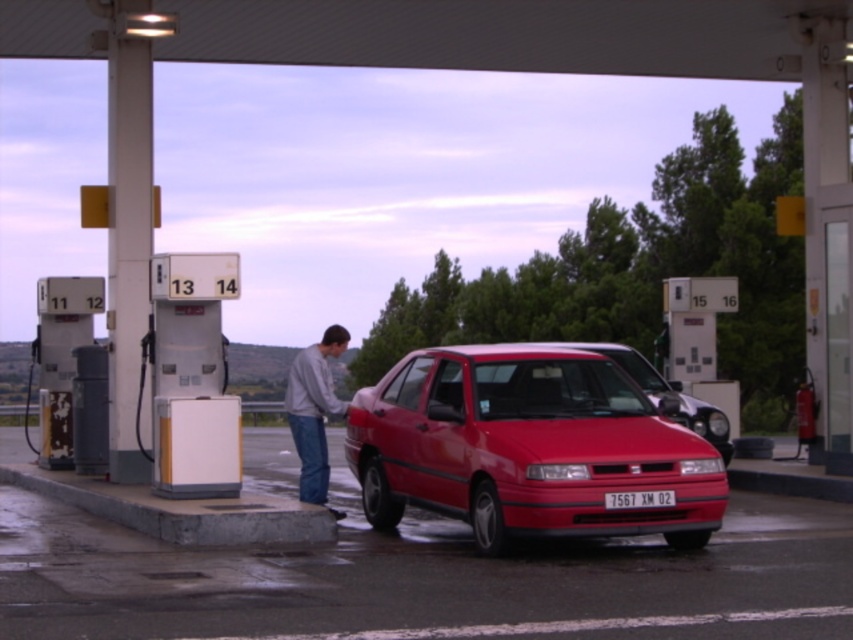
You are a delivery driver who needs to park your truck next to the matte red sedan at center. The truck is 1.5 meters wider than the sedan. Can you safely park your truck without overlapping the white plastic license plate at center?

The matte red sedan at center is bigger than the white plastic license plate at center. Since the truck is 1.5 meters wider than the sedan, it would likely overlap the white plastic license plate at center when parked next to it.

You are a delivery driver who needs to deliver a package to a customer standing at the gas station. The customer is wearing the gray cotton shirt at center. Your vehicle has a 12 meter maximum delivery range. Can you deliver the package without leaving your vehicle?

The gray cotton shirt at center is 11.21 meters away from the camera, so yes, the delivery driver can deliver the package without leaving the vehicle since the distance is within the 12 meter range.

You are a delivery driver who needs to park your truck next to the shiny red sedan at center and the matte red sedan at center at the gas station. Which sedan should you park closer to if you want to maximize the remaining parking space for your truck?

You should park closer to the shiny red sedan at center because it occupies less space than the matte red sedan at center, leaving more room for your truck.